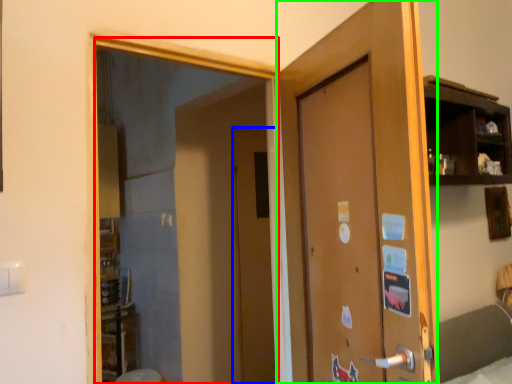
Question: Considering the real-world distances, which object is closest to mirror (highlighted by a red box)? door (highlighted by a blue box) or door (highlighted by a green box).

Choices:
 (A) door
 (B) door

Answer: (A)